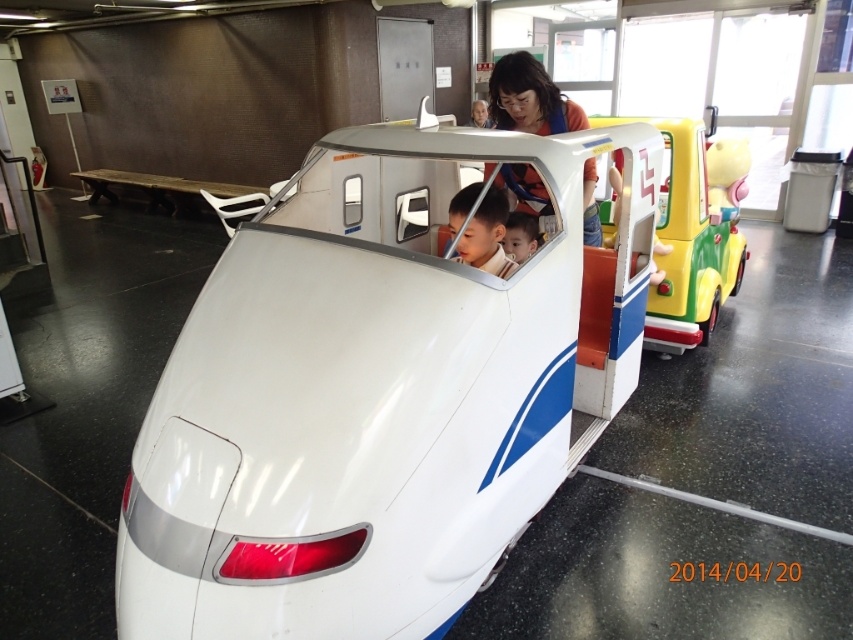
Question: Observing the image, what is the correct spatial positioning of matte white boy at center in reference to smooth skin face at center?

Choices:
 (A) right
 (B) left

Answer: (B)

Question: Among these points, which one is nearest to the camera?

Choices:
 (A) (532, 97)
 (B) (498, 257)

Answer: (B)

Question: Is matte orange shirt at upper center to the right of smooth skin face at center from the viewer's perspective?

Choices:
 (A) yes
 (B) no

Answer: (A)

Question: Based on their relative distances, which object is nearer to the matte white boy at center?

Choices:
 (A) matte yellow plastic toy car at right
 (B) white glossy train at center
 (C) matte orange shirt at upper center

Answer: (C)

Question: Which object appears closest to the camera in this image?

Choices:
 (A) white glossy train at center
 (B) matte yellow plastic toy car at right
 (C) matte orange shirt at upper center
 (D) smooth skin face at center

Answer: (A)

Question: Does matte yellow plastic toy car at right appear over matte orange shirt at upper center?

Choices:
 (A) yes
 (B) no

Answer: (A)